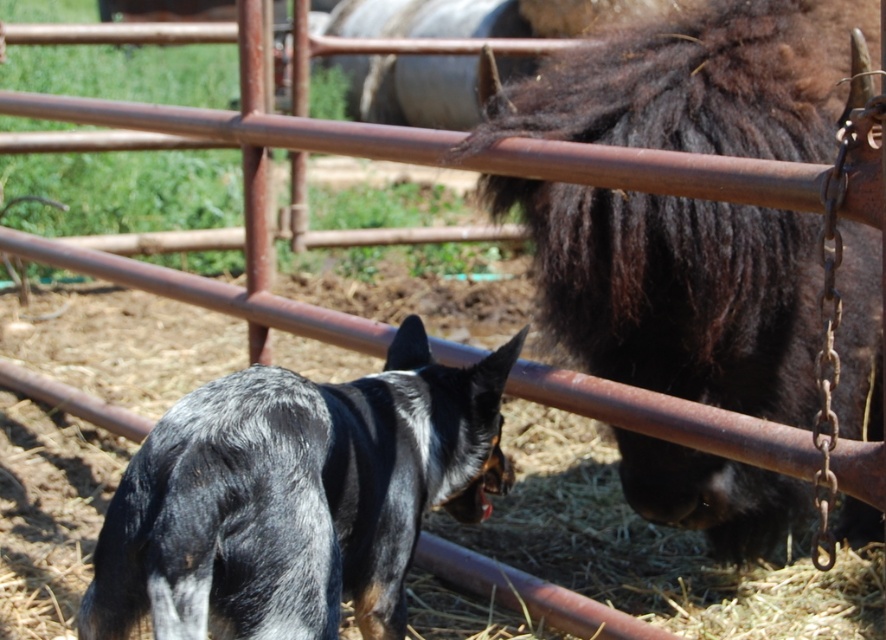
Question: Is brown fuzzy yak at center smaller than black and white fur dog at center?

Choices:
 (A) yes
 (B) no

Answer: (B)

Question: Which point is closer to the camera?

Choices:
 (A) (713, 13)
 (B) (390, 472)

Answer: (B)

Question: Is brown fuzzy yak at center above black and white fur dog at center?

Choices:
 (A) yes
 (B) no

Answer: (A)

Question: Which point is farther to the camera?

Choices:
 (A) black and white fur dog at center
 (B) brown fuzzy yak at center

Answer: (B)

Question: Which point is closer to the camera?

Choices:
 (A) (597, 96)
 (B) (416, 385)

Answer: (B)

Question: Does brown fuzzy yak at center lie in front of black and white fur dog at center?

Choices:
 (A) no
 (B) yes

Answer: (A)